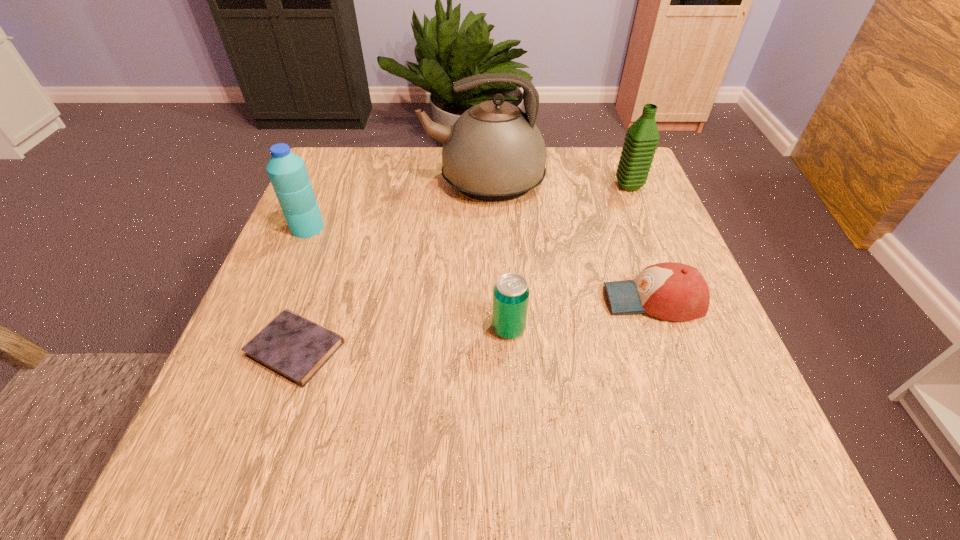
Image resolution: width=960 pixels, height=540 pixels. What are the coordinates of `object that is the third closest to the beer can` in the screenshot? It's located at (494, 152).

Identify which object is the second nearest to the nearer water bottle. Please provide its 2D coordinates. Your answer should be formatted as a tuple, i.e. [(x, y)], where the tuple contains the x and y coordinates of a point satisfying the conditions above.

[(291, 346)]

At what (x,y) coordinates should I click in order to perform the action: click on blank space that satisfies the following two spatial constraints: 1. at the spout of the beer can; 2. on the left side of the tallest object. Please return your answer as a coordinate pair (x, y). The width and height of the screenshot is (960, 540). Looking at the image, I should click on pyautogui.click(x=485, y=328).

You are a GUI agent. You are given a task and a screenshot of the screen. Output one action in this format:
    pyautogui.click(x=<x>, y=<y>)
    Task: Click on the vacant space that satisfies the following two spatial constraints: 1. at the spout of the kettle; 2. on the right side of the third shortest object
    The image size is (960, 540).
    Given the screenshot: What is the action you would take?
    pyautogui.click(x=485, y=328)

Where is `free location that satisfies the following two spatial constraints: 1. at the spout of the farther water bottle; 2. on the right side of the kettle`? This screenshot has width=960, height=540. free location that satisfies the following two spatial constraints: 1. at the spout of the farther water bottle; 2. on the right side of the kettle is located at coordinates (484, 186).